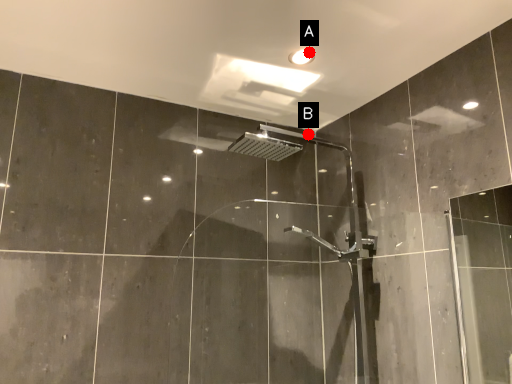
Question: Two points are circled on the image, labeled by A and B beside each circle. Which point is closer to the camera?

Choices:
 (A) A is closer
 (B) B is closer

Answer: (A)